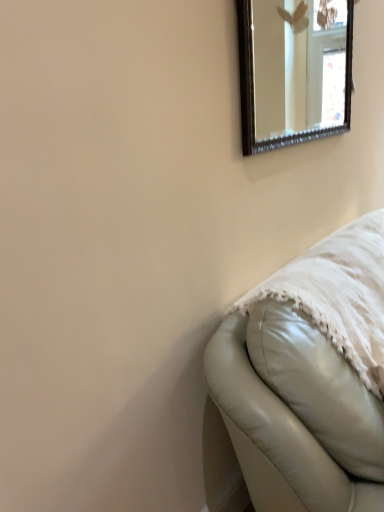
The height and width of the screenshot is (512, 384). I want to click on leather couch at lower right, so 308,376.

Describe the element at coordinates (308, 376) in the screenshot. I see `leather couch at lower right` at that location.

Image resolution: width=384 pixels, height=512 pixels. Find the location of `black-framed mirror at upper right`. black-framed mirror at upper right is located at coordinates (300, 65).

What do you see at coordinates (300, 65) in the screenshot? I see `black-framed mirror at upper right` at bounding box center [300, 65].

What are the coordinates of `leather couch at lower right` in the screenshot? It's located at (308, 376).

Can you confirm if black-framed mirror at upper right is positioned to the left of leather couch at lower right?

Yes.

Considering the positions of objects black-framed mirror at upper right and leather couch at lower right in the image provided, who is behind, black-framed mirror at upper right or leather couch at lower right?

Positioned behind is black-framed mirror at upper right.

Is point (308, 44) positioned behind point (366, 398)?

That is True.

From the image's perspective, is black-framed mirror at upper right on leather couch at lower right?

Yes, from the image's perspective, black-framed mirror at upper right is on top of leather couch at lower right.

From a real-world perspective, which object rests below the other?

From a 3D spatial view, leather couch at lower right is below.

Can you confirm if black-framed mirror at upper right is thinner than leather couch at lower right?

Yes.

Considering the sizes of objects black-framed mirror at upper right and leather couch at lower right in the image provided, who is shorter, black-framed mirror at upper right or leather couch at lower right?

With less height is black-framed mirror at upper right.

Who is smaller, black-framed mirror at upper right or leather couch at lower right?

black-framed mirror at upper right.

From the picture: Would you say black-framed mirror at upper right is inside or outside leather couch at lower right?

black-framed mirror at upper right is not enclosed by leather couch at lower right.

Is black-framed mirror at upper right not close to leather couch at lower right?

Yes, black-framed mirror at upper right and leather couch at lower right are located far from each other.

Is black-framed mirror at upper right facing away from leather couch at lower right?

No, black-framed mirror at upper right is not facing the opposite direction of leather couch at lower right.

How different are the orientations of black-framed mirror at upper right and leather couch at lower right in degrees?

0.0931 degrees.

Where is `furniture that appears below the black-framed mirror at upper right (from a real-world perspective)`? This screenshot has height=512, width=384. furniture that appears below the black-framed mirror at upper right (from a real-world perspective) is located at coordinates (308, 376).

Is leather couch at lower right to the left of black-framed mirror at upper right from the viewer's perspective?

No, leather couch at lower right is not to the left of black-framed mirror at upper right.

Considering the relative positions of leather couch at lower right and black-framed mirror at upper right in the image provided, is leather couch at lower right behind black-framed mirror at upper right?

No, leather couch at lower right is in front of black-framed mirror at upper right.

Is point (292, 305) farther from viewer compared to point (257, 84)?

That is False.

From the image's perspective, is leather couch at lower right on black-framed mirror at upper right?

No.

From a real-world perspective, is leather couch at lower right located beneath black-framed mirror at upper right?

Yes, from a real-world perspective, leather couch at lower right is below black-framed mirror at upper right.

Considering the relative sizes of leather couch at lower right and black-framed mirror at upper right in the image provided, is leather couch at lower right thinner than black-framed mirror at upper right?

No.

Can you confirm if leather couch at lower right is shorter than black-framed mirror at upper right?

No, leather couch at lower right is not shorter than black-framed mirror at upper right.

Does leather couch at lower right have a larger size compared to black-framed mirror at upper right?

Yes.

Is leather couch at lower right inside the boundaries of black-framed mirror at upper right, or outside?

leather couch at lower right cannot be found inside black-framed mirror at upper right.

Is leather couch at lower right positioned far away from black-framed mirror at upper right?

Yes.

Is black-framed mirror at upper right at the back of leather couch at lower right?

No, black-framed mirror at upper right is not at the back of leather couch at lower right.

How many degrees apart are the facing directions of leather couch at lower right and black-framed mirror at upper right?

The angle between the facing direction of leather couch at lower right and the facing direction of black-framed mirror at upper right is 0.0931 degrees.

How distant is leather couch at lower right from black-framed mirror at upper right?

They are 3.00 meters apart.

Identify the location of furniture on the right of black-framed mirror at upper right. (308, 376).

Identify the location of furniture that is below the black-framed mirror at upper right (from the image's perspective). (308, 376).

You are a GUI agent. You are given a task and a screenshot of the screen. Output one action in this format:
    pyautogui.click(x=<x>, y=<y>)
    Task: Click on the mirror above the leather couch at lower right (from a real-world perspective)
    
    Given the screenshot: What is the action you would take?
    pyautogui.click(x=300, y=65)